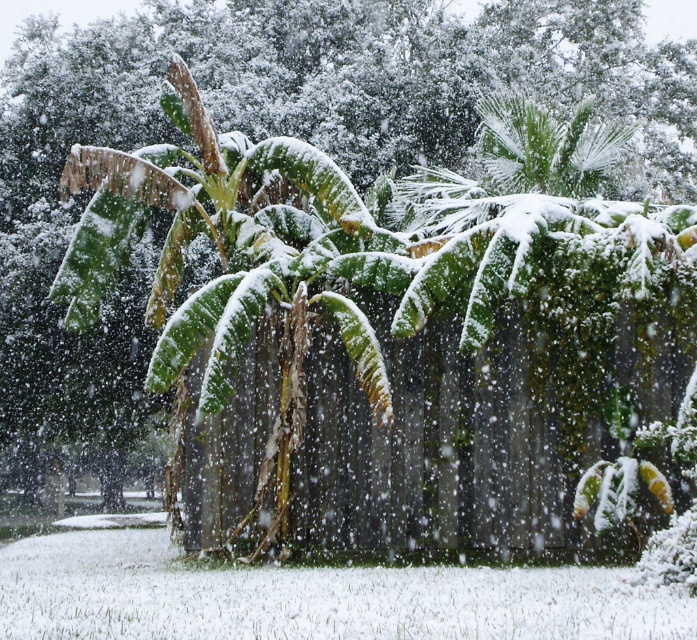
You are a gardener assessing the winter scene. You see the green wood fence at center and the green leafy palm at center. Which one is taller?

The green wood fence at center is much taller than the green leafy palm at center.

In the scene shown: You are a gardener planning to place a new small statue between the green wood fence at center and the green leafy palm at center. Considering their sizes, which object should the statue be placed closer to, the larger one or the smaller one?

The green wood fence at center is larger than the green leafy palm at center, so the statue should be placed closer to the green wood fence at center.

You are standing in the winter scene and want to locate the green wood fence at center. Which direction should you look to find it?

You should look towards the center of the scene to find the green wood fence at center, as it is located at point coordinates approximately 0.673 on the x axis and 0.621 on the y axis.